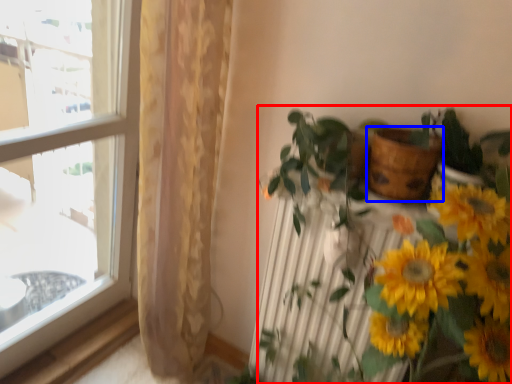
Question: Which point is closer to the camera, houseplant (highlighted by a red box) or flowerpot (highlighted by a blue box)?

Choices:
 (A) houseplant
 (B) flowerpot

Answer: (A)